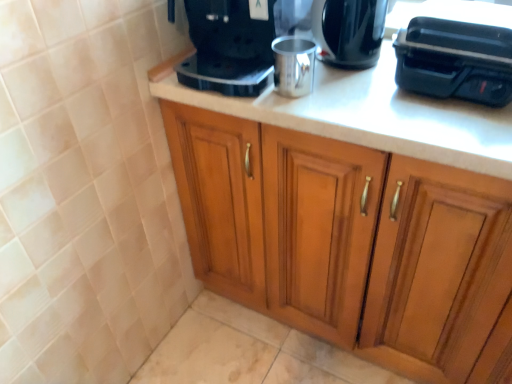
Identify the location of vacant area that is situated to the right of silver metallic cup at center, positioned as the second appliance in right-to-left order. This screenshot has width=512, height=384. (370, 97).